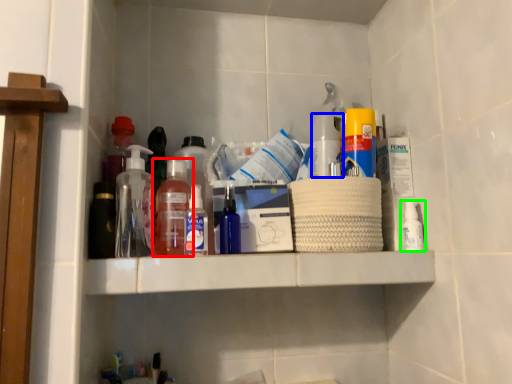
Question: Which object is the farthest from bottle (highlighted by a red box)? Choose among these: bottle (highlighted by a blue box) or bottle (highlighted by a green box).

Choices:
 (A) bottle
 (B) bottle

Answer: (B)